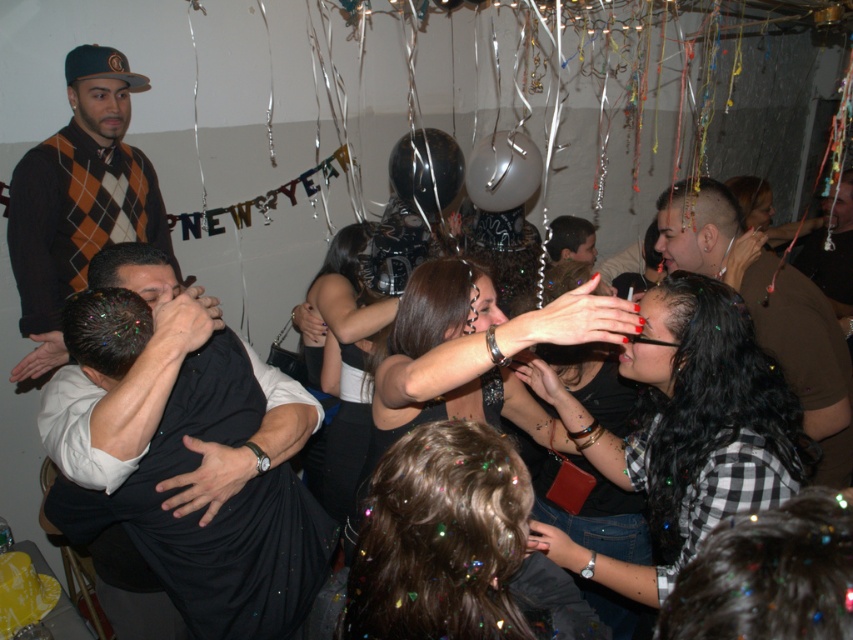
Question: Which point is farther to the camera?

Choices:
 (A) shiny metallic balloon at center
 (B) argyle sweater at upper left

Answer: (A)

Question: Estimate the real-world distances between objects in this image. Which object is farther from the shiny brown leather jacket at right?

Choices:
 (A) shiny metallic balloon at center
 (B) translucent plastic balloon at upper center

Answer: (A)

Question: Is shiny brown leather jacket at right positioned at the back of translucent plastic balloon at upper center?

Choices:
 (A) no
 (B) yes

Answer: (A)

Question: Where is argyle sweater at upper left located in relation to translucent plastic balloon at upper center in the image?

Choices:
 (A) above
 (B) below

Answer: (B)

Question: Which point is farther to the camera?

Choices:
 (A) shiny brown leather jacket at right
 (B) argyle sweater at upper left

Answer: (B)

Question: Is the position of argyle sweater at upper left less distant than that of translucent plastic balloon at upper center?

Choices:
 (A) yes
 (B) no

Answer: (A)